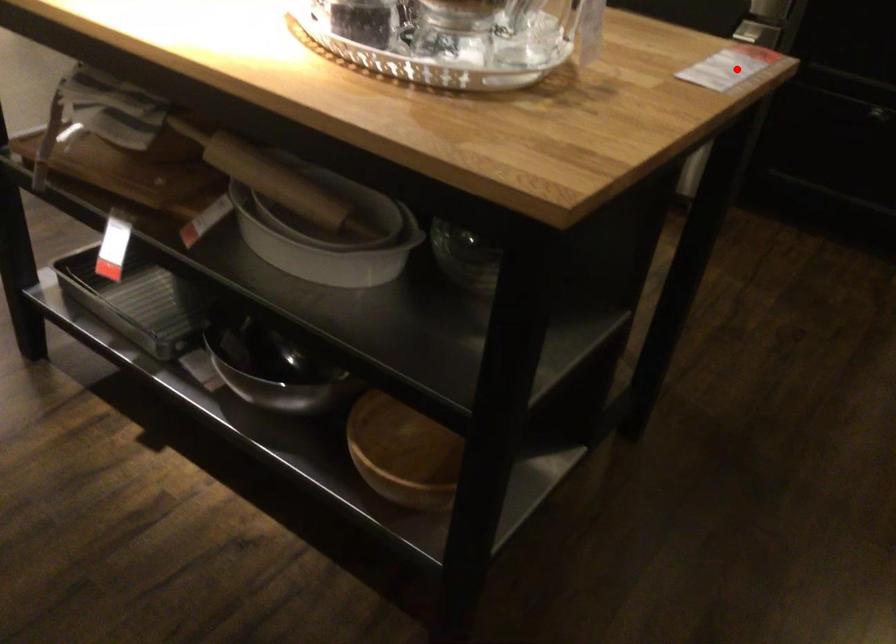
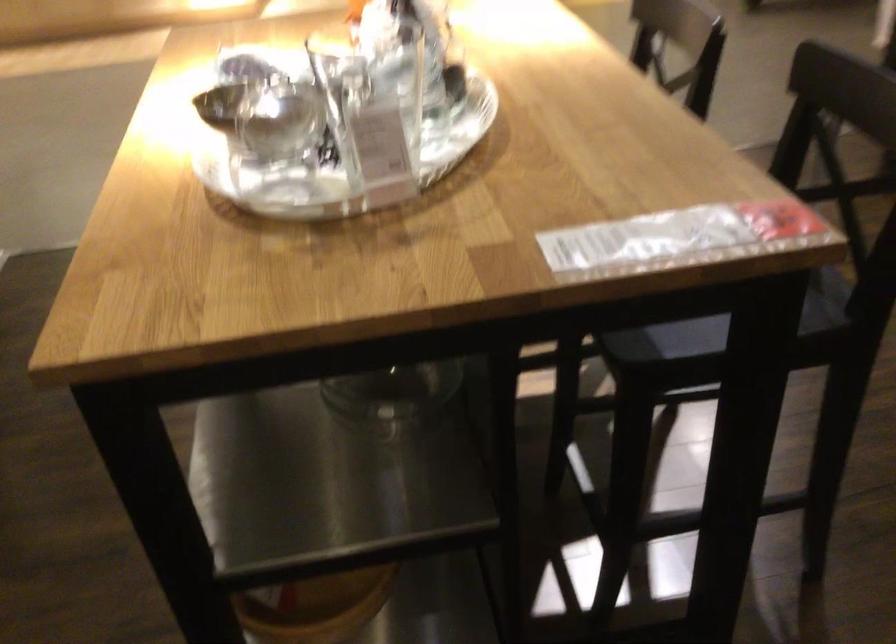
Question: I am providing you with two images of the same scene from different viewpoints. Given a red point in image1, look at the same physical point in image2. Is it:

Choices:
 (A) Closer to the viewpoint
 (B) Farther from the viewpoint

Answer: (A)